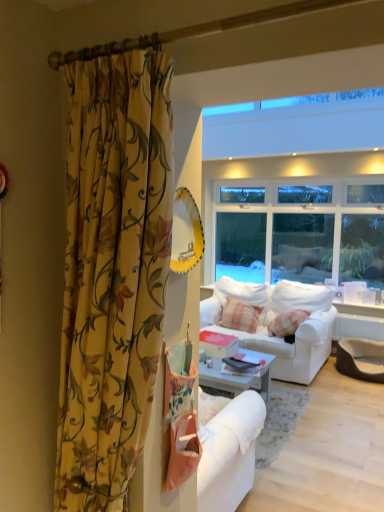
Question: From a real-world perspective, does white fabric couch at center sit lower than striped cotton pillow at center?

Choices:
 (A) yes
 (B) no

Answer: (A)

Question: Is white fabric couch at center turned away from striped cotton pillow at center?

Choices:
 (A) yes
 (B) no

Answer: (A)

Question: Does white fabric couch at center have a lesser height compared to striped cotton pillow at center?

Choices:
 (A) yes
 (B) no

Answer: (B)

Question: Does white fabric couch at center have a greater width compared to striped cotton pillow at center?

Choices:
 (A) no
 (B) yes

Answer: (B)

Question: Considering the relative positions of white fabric couch at center and striped cotton pillow at center in the image provided, is white fabric couch at center in front of striped cotton pillow at center?

Choices:
 (A) no
 (B) yes

Answer: (B)

Question: Based on their positions, is striped cotton pillow at center located to the left or right of white fabric couch at center?

Choices:
 (A) right
 (B) left

Answer: (B)

Question: From a real-world perspective, is striped cotton pillow at center above or below white fabric couch at center?

Choices:
 (A) below
 (B) above

Answer: (B)

Question: Is striped cotton pillow at center spatially inside white fabric couch at center, or outside of it?

Choices:
 (A) inside
 (B) outside

Answer: (A)

Question: Considering the positions of point (248, 306) and point (319, 359), is point (248, 306) closer or farther from the camera than point (319, 359)?

Choices:
 (A) closer
 (B) farther

Answer: (B)

Question: From the image's perspective, is white fabric couch at center above or below floral fabric curtain at left?

Choices:
 (A) above
 (B) below

Answer: (B)

Question: Is point (332, 322) closer or farther from the camera than point (125, 138)?

Choices:
 (A) closer
 (B) farther

Answer: (B)

Question: Looking at the image, does white fabric couch at center seem bigger or smaller compared to floral fabric curtain at left?

Choices:
 (A) small
 (B) big

Answer: (B)

Question: Would you say white fabric couch at center is inside or outside floral fabric curtain at left?

Choices:
 (A) inside
 (B) outside

Answer: (B)

Question: Considering the positions of striped cotton pillow at center and floral fabric curtain at left in the image, is striped cotton pillow at center bigger or smaller than floral fabric curtain at left?

Choices:
 (A) big
 (B) small

Answer: (B)

Question: In terms of height, does striped cotton pillow at center look taller or shorter compared to floral fabric curtain at left?

Choices:
 (A) short
 (B) tall

Answer: (A)